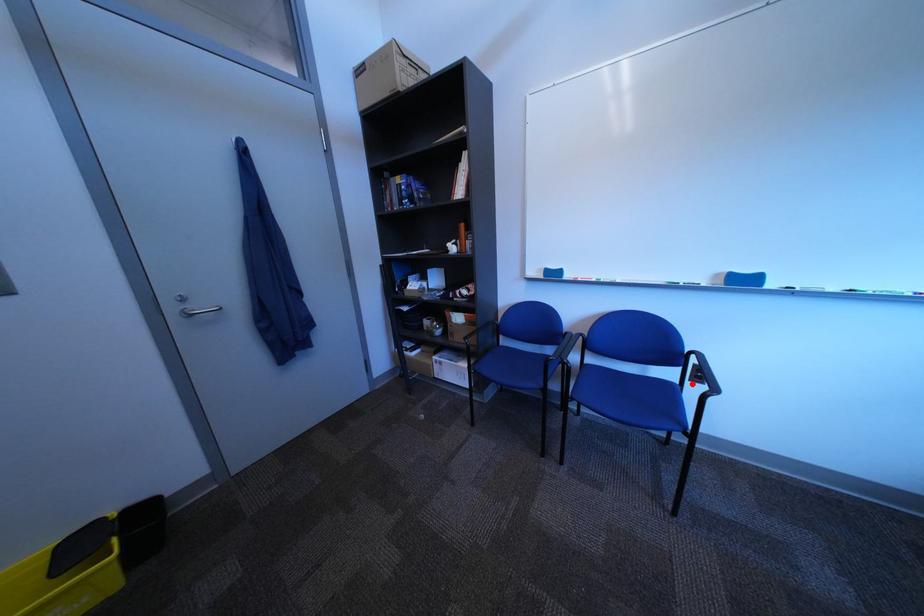
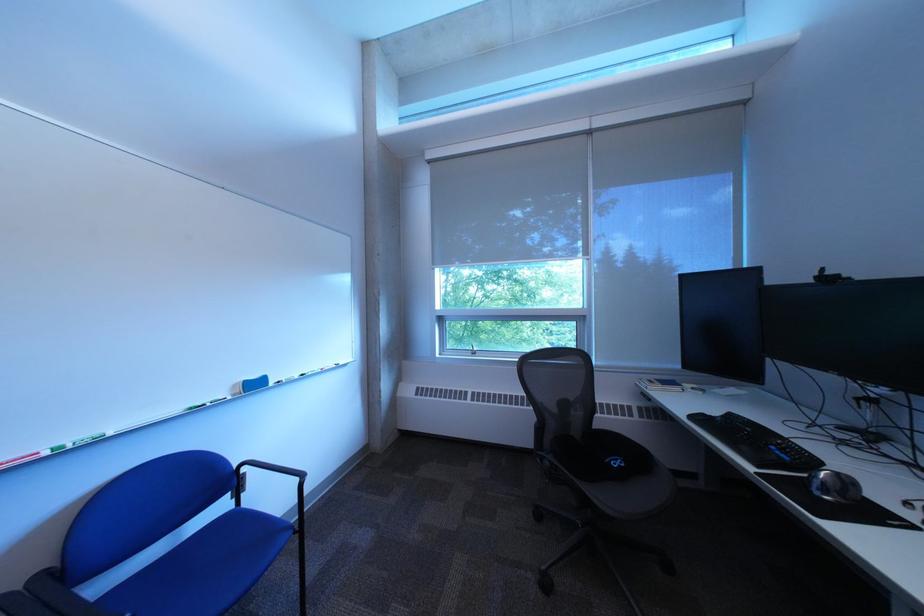
The point at the highlighted location is marked in the first image. Where is the corresponding point in the second image?

(248, 508)